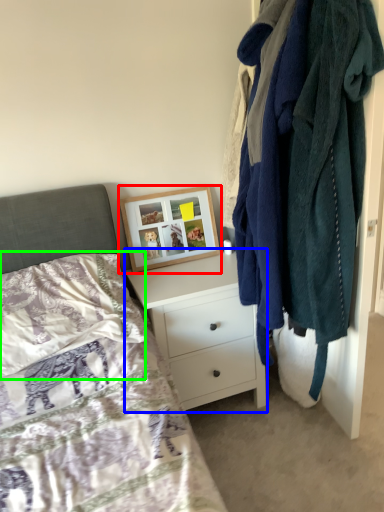
Question: Considering the real-world distances, which object is farthest from picture frame (highlighted by a red box)? chest of drawers (highlighted by a blue box) or pillow (highlighted by a green box)?

Choices:
 (A) chest of drawers
 (B) pillow

Answer: (B)